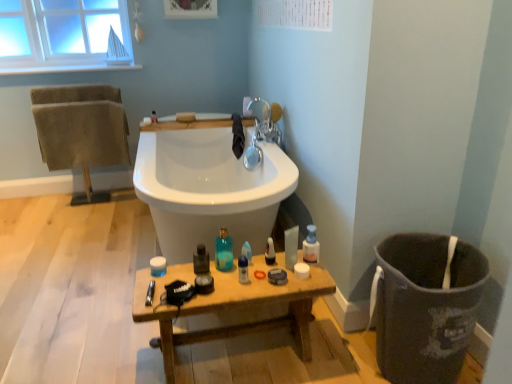
The height and width of the screenshot is (384, 512). Identify the location of free spot in front of translucent plastic spray bottle at center, arranged as the 2th cleaning product when viewed from the left. (266, 279).